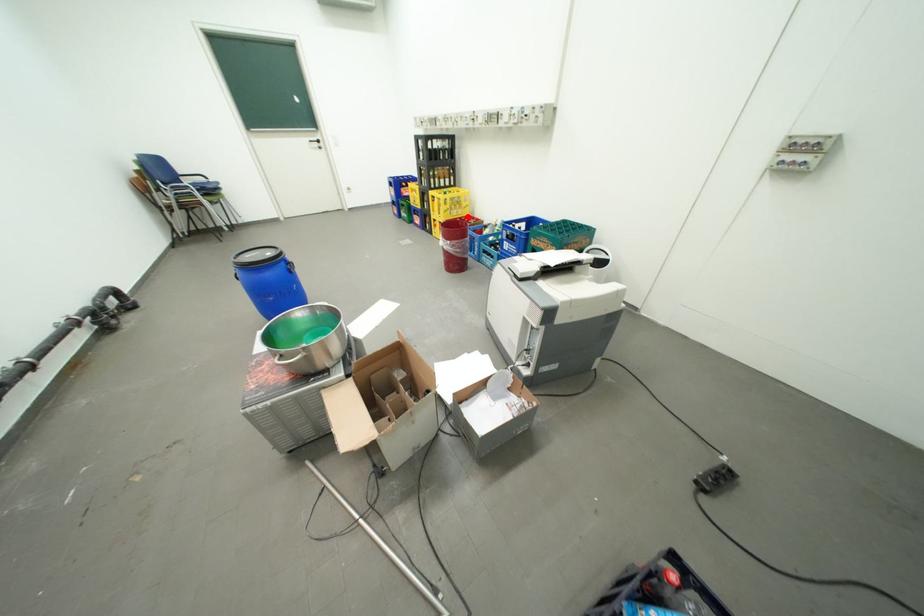
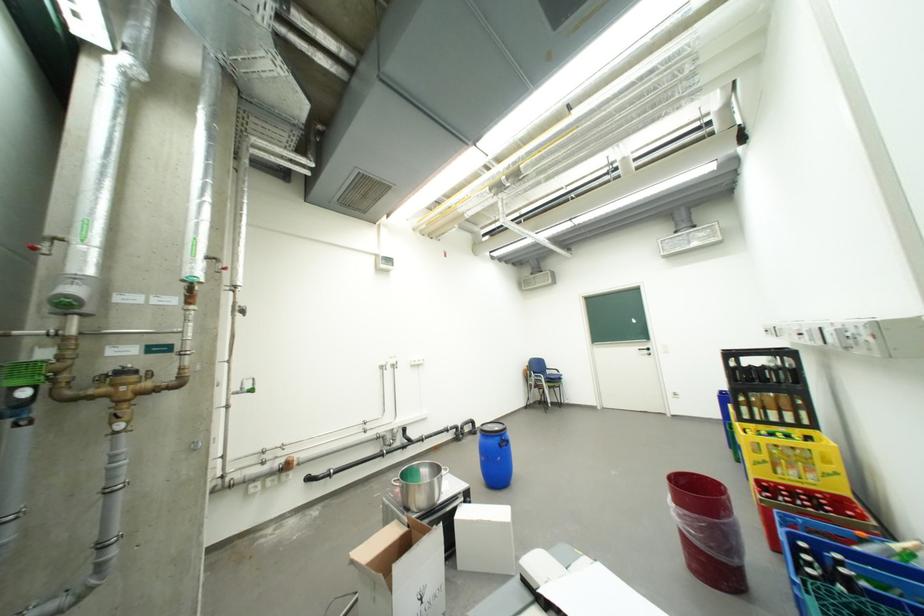
Question: I am providing you with two images of the same scene from different viewpoints. In image1, a red point is highlighted. Considering the same 3D point in image2, which of the following is correct?

Choices:
 (A) It is closer
 (B) It is farther

Answer: (A)